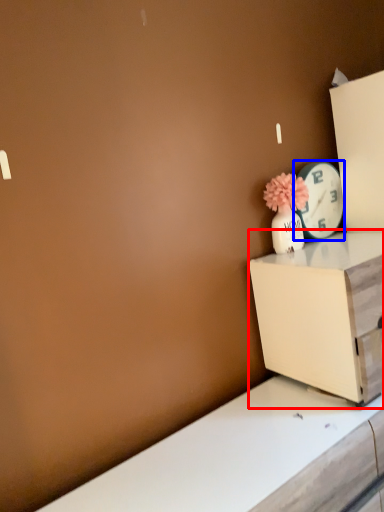
Question: Which object is closer to the camera taking this photo, nightstand (highlighted by a red box) or clock (highlighted by a blue box)?

Choices:
 (A) nightstand
 (B) clock

Answer: (A)